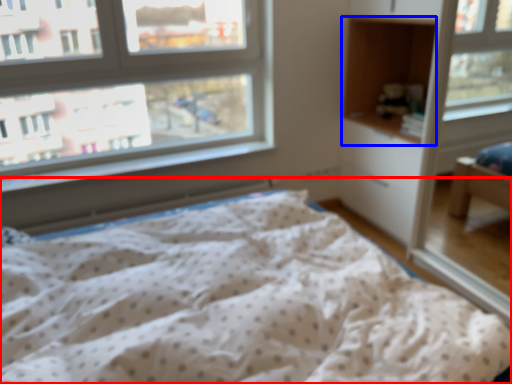
Question: Which of the following is the farthest to the observer, bed (highlighted by a red box) or cabinet (highlighted by a blue box)?

Choices:
 (A) bed
 (B) cabinet

Answer: (B)